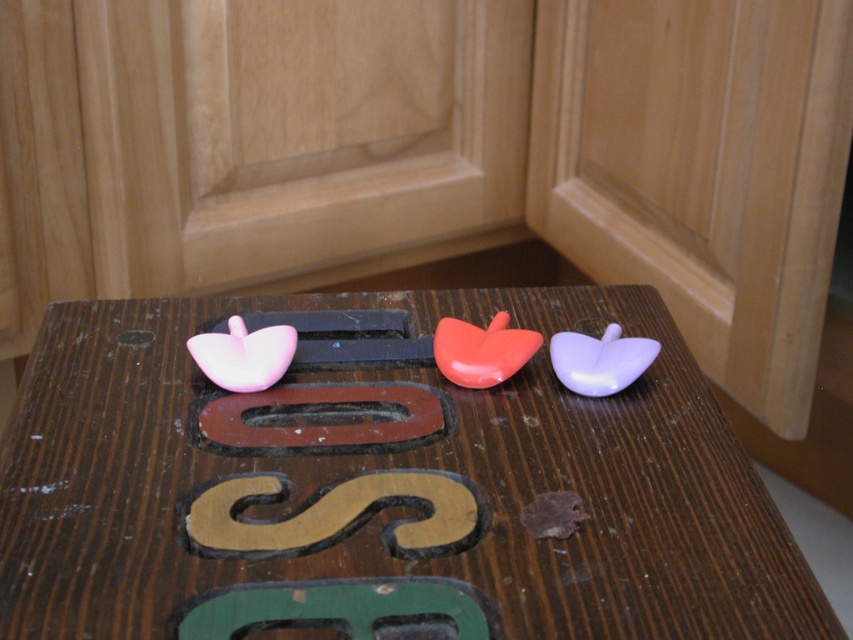
You are a child trying to reach for the brown matte letter s at center and the brown matte letter o at center on your wooden table. Which letter will you touch first if you extend your hand straight ahead?

The brown matte letter s at center is closer to the viewer than the brown matte letter o at center, so you will touch the brown matte letter s at center first.

In the scene shown: You are standing in front of the wooden surface and want to place a new decorative item exactly where the wooden table at center is located. What are the coordinates where you should place the item?

The wooden table at center is located at coordinates point [381,490], so you should place the new decorative item there.